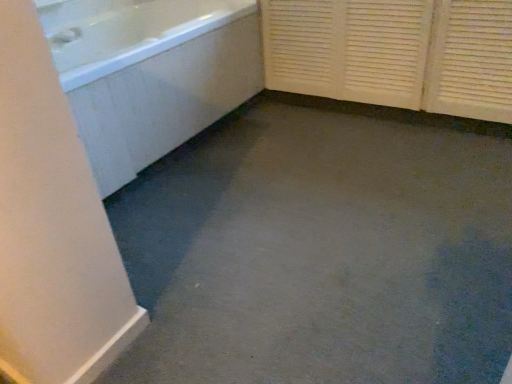
Measure the distance between point (96, 12) and camera.

Point (96, 12) and camera are 7.69 feet apart from each other.

This screenshot has width=512, height=384. What do you see at coordinates (394, 53) in the screenshot? I see `white textured screen door at right` at bounding box center [394, 53].

What are the coordinates of `white glossy bathtub at upper left` in the screenshot? It's located at (152, 74).

Does point (270, 77) appear closer or farther from the camera than point (236, 58)?

Clearly, point (270, 77) is more distant from the camera than point (236, 58).

Is white textured screen door at right at the left side of white glossy bathtub at upper left?

In fact, white textured screen door at right is to the right of white glossy bathtub at upper left.

Is white textured screen door at right oriented away from white glossy bathtub at upper left?

No, white textured screen door at right is not facing away from white glossy bathtub at upper left.

Based on the photo, from the image's perspective, which is below, white textured screen door at right or white glossy bathtub at upper left?

white glossy bathtub at upper left, from the image's perspective.

Is white glossy faucet at upper left located outside white textured screen door at right?

white glossy faucet at upper left is positioned outside white textured screen door at right.

Is white textured screen door at right at the back of white glossy faucet at upper left?

No, white glossy faucet at upper left is not facing the opposite direction of white textured screen door at right.

Looking at this image, can you confirm if white glossy faucet at upper left is smaller than white textured screen door at right?

Yes, white glossy faucet at upper left is smaller than white textured screen door at right.

Is white textured screen door at right not close to white glossy faucet at upper left?

That's right, there is a large distance between white textured screen door at right and white glossy faucet at upper left.

In terms of size, does white textured screen door at right appear bigger or smaller than white glossy faucet at upper left?

Clearly, white textured screen door at right is larger in size than white glossy faucet at upper left.

How different are the orientations of white textured screen door at right and white glossy faucet at upper left in degrees?

89.7 degrees separate the facing orientations of white textured screen door at right and white glossy faucet at upper left.

Would you say white textured screen door at right contains white glossy faucet at upper left?

That's incorrect, white glossy faucet at upper left is not inside white textured screen door at right.

How far apart are white glossy bathtub at upper left and white textured screen door at right?

28.37 inches.

From the image's perspective, is white glossy bathtub at upper left on white textured screen door at right?

Incorrect, from the image's perspective, white glossy bathtub at upper left is lower than white textured screen door at right.

Is white glossy bathtub at upper left bigger than white textured screen door at right?

Indeed, white glossy bathtub at upper left has a larger size compared to white textured screen door at right.

Can you confirm if white glossy bathtub at upper left is thinner than white textured screen door at right?

No, white glossy bathtub at upper left is not thinner than white textured screen door at right.

Looking at this image, between white glossy faucet at upper left and white glossy bathtub at upper left, which one has more height?

Standing taller between the two is white glossy bathtub at upper left.

Can you confirm if white glossy faucet at upper left is thinner than white glossy bathtub at upper left?

Yes.

Locate an element on the screen. The width and height of the screenshot is (512, 384). bathtub located below the white glossy faucet at upper left (from the image's perspective) is located at coordinates (152, 74).

Is white glossy faucet at upper left oriented towards white glossy bathtub at upper left?

Yes, white glossy faucet at upper left is facing white glossy bathtub at upper left.

Who is taller, white glossy bathtub at upper left or white glossy faucet at upper left?

white glossy bathtub at upper left.

Can you confirm if white glossy bathtub at upper left is thinner than white glossy faucet at upper left?

Incorrect, the width of white glossy bathtub at upper left is not less than that of white glossy faucet at upper left.

Locate an element on the screen. Image resolution: width=512 pixels, height=384 pixels. faucet that appears above the white glossy bathtub at upper left (from the image's perspective) is located at coordinates (65, 38).

Identify the location of bathtub that is above the white textured screen door at right (from a real-world perspective). This screenshot has height=384, width=512. (152, 74).

Find the location of a particular element. This screenshot has width=512, height=384. screen door on the right of white glossy faucet at upper left is located at coordinates (394, 53).

Based on their spatial positions, is white textured screen door at right or white glossy faucet at upper left further from white glossy bathtub at upper left?

Based on the image, white textured screen door at right appears to be further to white glossy bathtub at upper left.

When comparing their distances from white textured screen door at right, does white glossy bathtub at upper left or white glossy faucet at upper left seem further?

Among the two, white glossy faucet at upper left is located further to white textured screen door at right.

From the image, which object appears to be nearer to white glossy faucet at upper left, white textured screen door at right or white glossy bathtub at upper left?

white glossy bathtub at upper left is positioned closer to the anchor white glossy faucet at upper left.

Based on their spatial positions, is white glossy faucet at upper left or white glossy bathtub at upper left further from white textured screen door at right?

Based on the image, white glossy faucet at upper left appears to be further to white textured screen door at right.

Looking at the image, which one is located closer to white glossy faucet at upper left, white glossy bathtub at upper left or white textured screen door at right?

white glossy bathtub at upper left.

Which object lies nearer to the anchor point white glossy bathtub at upper left, white glossy faucet at upper left or white textured screen door at right?

white glossy faucet at upper left is positioned closer to the anchor white glossy bathtub at upper left.

I want to click on bathtub between white glossy faucet at upper left and white textured screen door at right in the horizontal direction, so click(x=152, y=74).